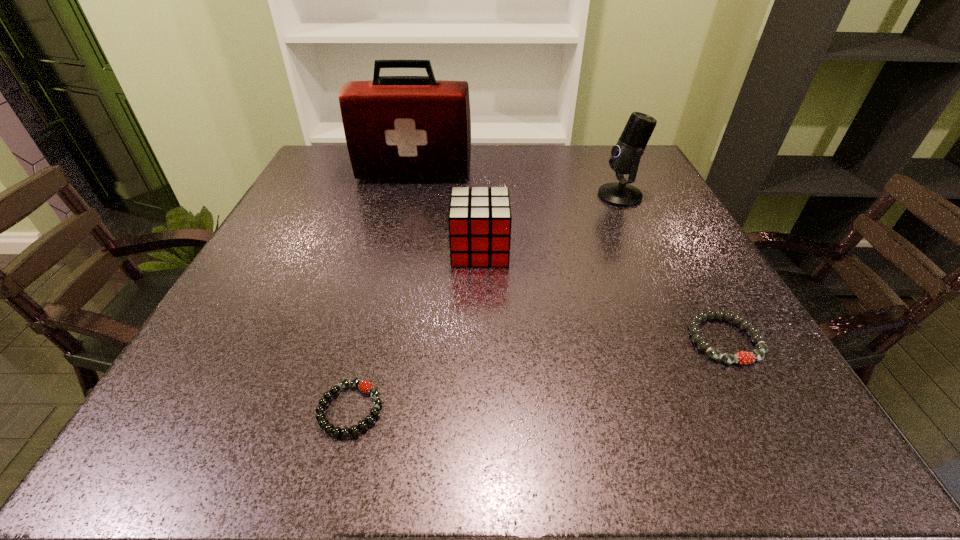
Find the location of a particular element. The height and width of the screenshot is (540, 960). the tallest object is located at coordinates (396, 127).

Identify the location of microphone. The image size is (960, 540). (625, 157).

Image resolution: width=960 pixels, height=540 pixels. Identify the location of the third shortest object. (479, 220).

Find the location of a particular element. Image resolution: width=960 pixels, height=540 pixels. the third farthest object is located at coordinates (479, 220).

Image resolution: width=960 pixels, height=540 pixels. I want to click on the taller bracelet, so click(x=742, y=357).

You are a GUI agent. You are given a task and a screenshot of the screen. Output one action in this format:
    pyautogui.click(x=<x>, y=<y>)
    Task: Click on the fourth farthest object
    The image size is (960, 540).
    Given the screenshot: What is the action you would take?
    pyautogui.click(x=742, y=357)

I want to click on the nearer bracelet, so click(x=368, y=388).

I want to click on the nearest object, so click(x=368, y=388).

In order to click on vacant region located on the side of the tallest object with the cross symbol in this screenshot , I will do `click(406, 206)`.

At what (x,y) coordinates should I click in order to perform the action: click on vacant space situated on the stand of the microphone. Please return your answer as a coordinate pair (x, y). The image size is (960, 540). Looking at the image, I should click on (558, 195).